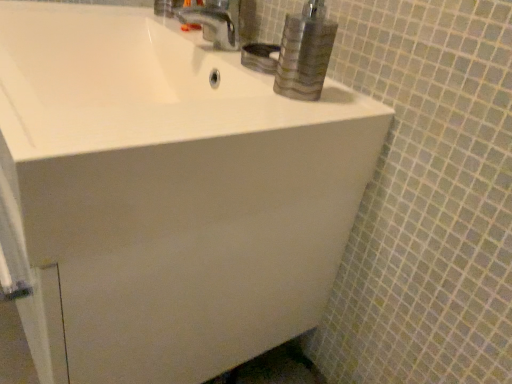
The width and height of the screenshot is (512, 384). What are the coordinates of `white glossy sink at upper center` in the screenshot? It's located at (136, 83).

What do you see at coordinates (136, 83) in the screenshot? The image size is (512, 384). I see `white glossy sink at upper center` at bounding box center [136, 83].

The image size is (512, 384). Describe the element at coordinates (213, 22) in the screenshot. I see `metallic silver faucet at upper center` at that location.

Locate an element on the screen. metallic silver faucet at upper center is located at coordinates (213, 22).

Measure the distance between point (228,38) and camera.

They are 31.22 inches apart.

Consider the image. What is the approximate width of metallic silver faucet at upper center?

The width of metallic silver faucet at upper center is 6.98 inches.

This screenshot has width=512, height=384. I want to click on white glossy sink at upper center, so click(x=136, y=83).

Is white glossy sink at upper center to the left of metallic silver faucet at upper center from the viewer's perspective?

Yes, white glossy sink at upper center is to the left of metallic silver faucet at upper center.

Does white glossy sink at upper center come in front of metallic silver faucet at upper center?

Yes, the depth of white glossy sink at upper center is less than that of metallic silver faucet at upper center.

Does point (80, 64) appear closer or farther from the camera than point (186, 15)?

Point (80, 64).

From the image's perspective, which one is positioned higher, white glossy sink at upper center or metallic silver faucet at upper center?

metallic silver faucet at upper center, from the image's perspective.

From a real-world perspective, is white glossy sink at upper center physically below metallic silver faucet at upper center?

Correct, in the physical world, white glossy sink at upper center is lower than metallic silver faucet at upper center.

Which object is thinner, white glossy sink at upper center or metallic silver faucet at upper center?

metallic silver faucet at upper center is thinner.

Does white glossy sink at upper center have a lesser height compared to metallic silver faucet at upper center?

Yes.

Can you confirm if white glossy sink at upper center is bigger than metallic silver faucet at upper center?

Correct, white glossy sink at upper center is larger in size than metallic silver faucet at upper center.

Is metallic silver faucet at upper center located within white glossy sink at upper center?

Definitely not — metallic silver faucet at upper center is not inside white glossy sink at upper center.

Does white glossy sink at upper center touch metallic silver faucet at upper center?

No, white glossy sink at upper center is not making contact with metallic silver faucet at upper center.

Consider the image. Is white glossy sink at upper center oriented towards metallic silver faucet at upper center?

No.

How many degrees apart are the facing directions of white glossy sink at upper center and metallic silver faucet at upper center?

1.02 degrees.

How far apart are white glossy sink at upper center and metallic silver faucet at upper center?

white glossy sink at upper center is 7.51 inches away from metallic silver faucet at upper center.

Image resolution: width=512 pixels, height=384 pixels. I want to click on sink that is in front of the metallic silver faucet at upper center, so click(x=136, y=83).

Can you confirm if metallic silver faucet at upper center is positioned to the right of white glossy sink at upper center?

Correct, you'll find metallic silver faucet at upper center to the right of white glossy sink at upper center.

Is metallic silver faucet at upper center further to the viewer compared to white glossy sink at upper center?

Yes, metallic silver faucet at upper center is further from the viewer.

Does point (201, 18) come behind point (144, 87)?

Yes, point (201, 18) is farther from viewer.

From the image's perspective, which is below, metallic silver faucet at upper center or white glossy sink at upper center?

white glossy sink at upper center appears lower in the image.

From the picture: From a real-world perspective, is metallic silver faucet at upper center beneath white glossy sink at upper center?

No, from a real-world perspective, metallic silver faucet at upper center is not under white glossy sink at upper center.

Which object is thinner, metallic silver faucet at upper center or white glossy sink at upper center?

metallic silver faucet at upper center.

Based on the photo, from their relative heights in the image, would you say metallic silver faucet at upper center is taller or shorter than white glossy sink at upper center?

Clearly, metallic silver faucet at upper center is taller compared to white glossy sink at upper center.

Is metallic silver faucet at upper center bigger or smaller than white glossy sink at upper center?

Considering their sizes, metallic silver faucet at upper center takes up less space than white glossy sink at upper center.

Is white glossy sink at upper center a part of metallic silver faucet at upper center?

Actually, white glossy sink at upper center is outside metallic silver faucet at upper center.

Is metallic silver faucet at upper center far from white glossy sink at upper center?

metallic silver faucet at upper center is actually quite close to white glossy sink at upper center.

Is metallic silver faucet at upper center aimed at white glossy sink at upper center?

No, metallic silver faucet at upper center is not turned towards white glossy sink at upper center.

Measure the distance between metallic silver faucet at upper center and white glossy sink at upper center.

They are 7.51 inches apart.

You are a GUI agent. You are given a task and a screenshot of the screen. Output one action in this format:
    pyautogui.click(x=<x>, y=<y>)
    Task: Click on the tap lying above the white glossy sink at upper center (from the image's perspective)
    
    Given the screenshot: What is the action you would take?
    pyautogui.click(x=213, y=22)

This screenshot has height=384, width=512. I want to click on tap lying behind the white glossy sink at upper center, so click(x=213, y=22).

What are the coordinates of `tap above the white glossy sink at upper center (from the image's perspective)` in the screenshot? It's located at (213, 22).